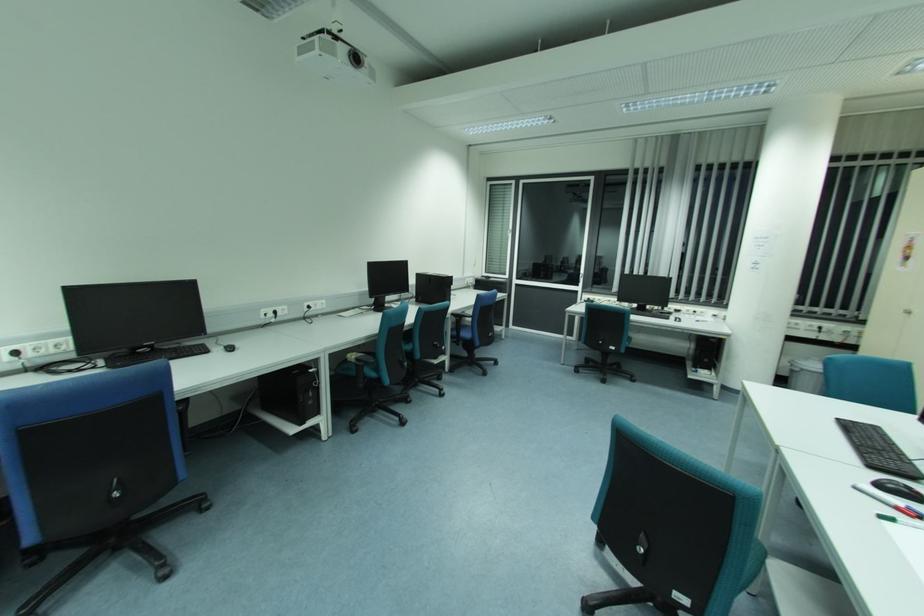
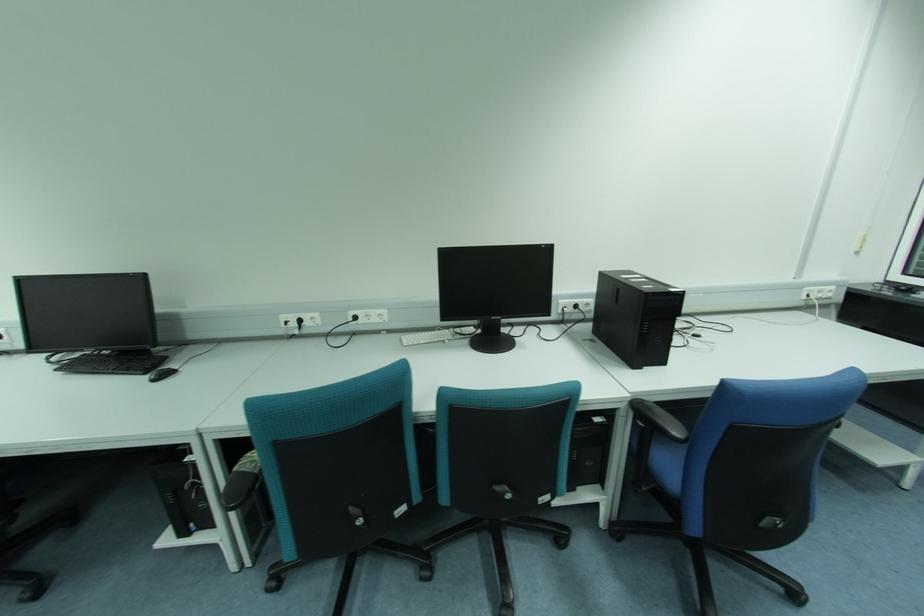
In the second image, find the point that corresponds to point (472, 278) in the first image.

(833, 288)